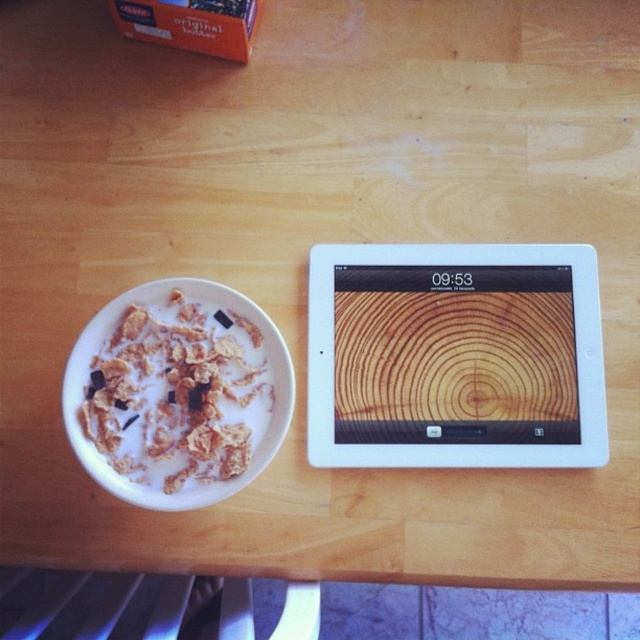
Question: Does white glossy tablet at upper center have a smaller size compared to white matte bowl at left?

Choices:
 (A) no
 (B) yes

Answer: (B)

Question: Which of the following is the farthest from the observer?

Choices:
 (A) (83, 356)
 (B) (449, 420)

Answer: (B)

Question: In this image, where is white glossy tablet at upper center located relative to white matte bowl at left?

Choices:
 (A) below
 (B) above

Answer: (B)

Question: Does white glossy tablet at upper center appear over white matte bowl at left?

Choices:
 (A) yes
 (B) no

Answer: (A)